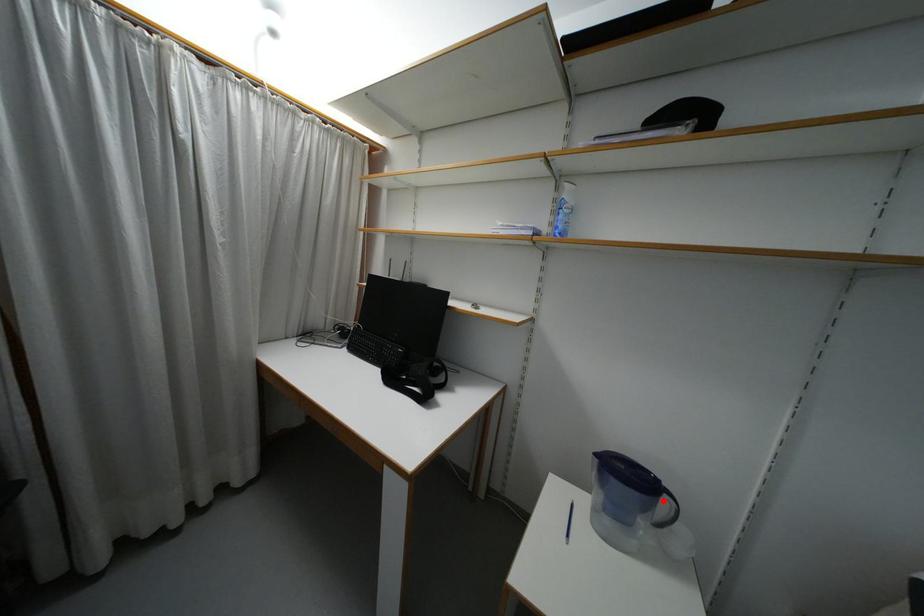
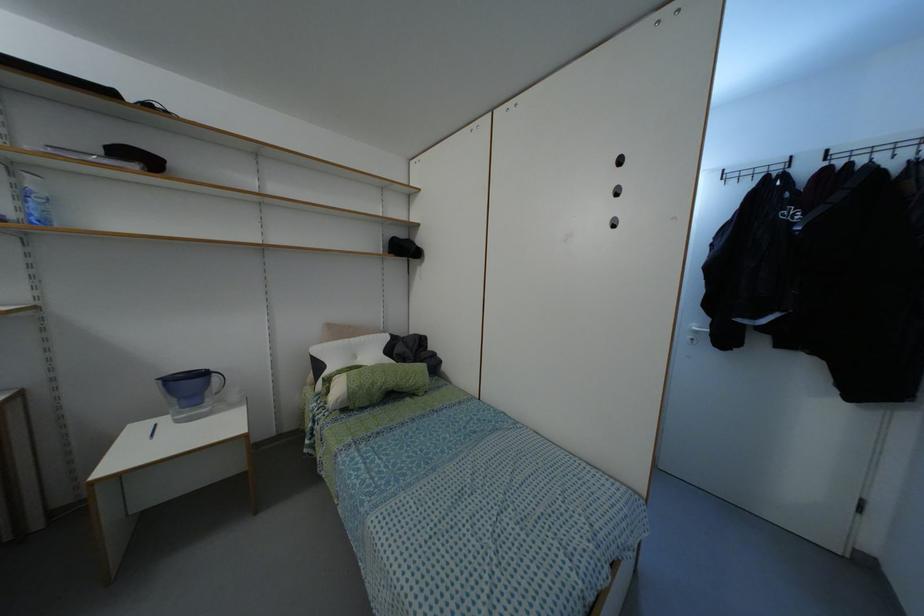
Locate, in the second image, the point that corresponds to the highlighted location in the first image.

(214, 378)